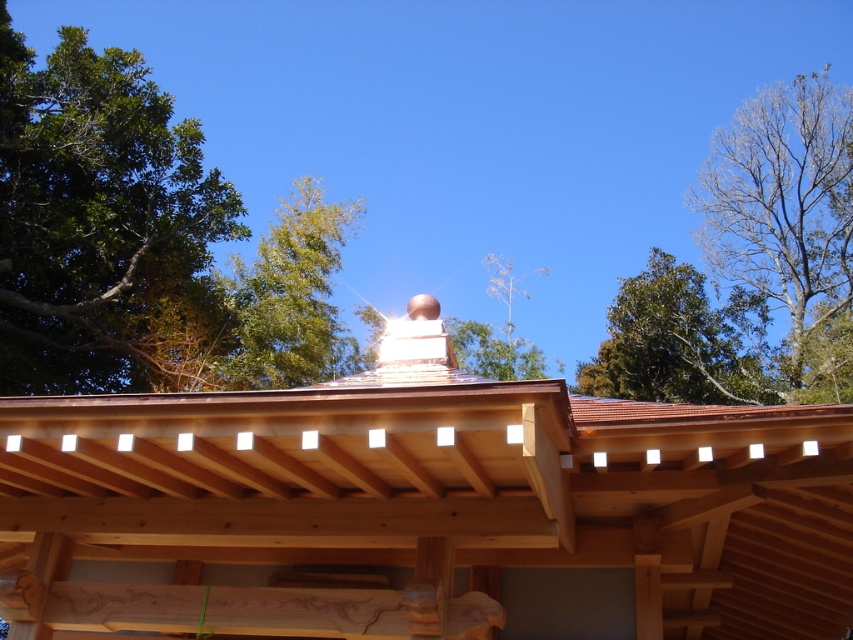
You are an architect designing a new garden layout. You want to plant a new tree that will grow to be the same size as the green leafy tree at upper left. If you want to place it so that it is exactly 55.43 feet away from the shiny copper roof at center, where should you plant it?

You should plant the new tree exactly where the green leafy tree at upper left is currently located, since the existing tree is already 55.43 feet away from the shiny copper roof at center.

You are standing in front of a traditional wooden structure and notice the shiny copper roof at center and the green leafy tree at upper left. Which object is located to the right of the other?

The shiny copper roof at center is positioned on the right side of green leafy tree at upper left.